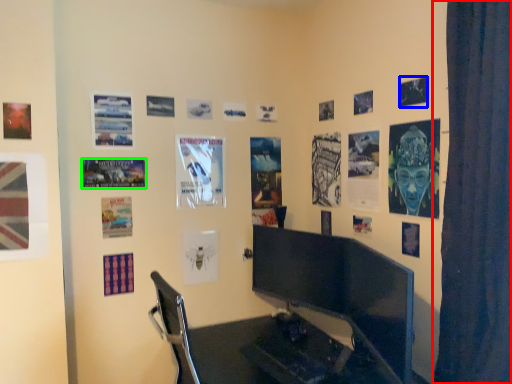
Question: Which object is the closest to the curtain (highlighted by a red box)? Choose among these: poster page (highlighted by a blue box) or poster page (highlighted by a green box).

Choices:
 (A) poster page
 (B) poster page

Answer: (A)